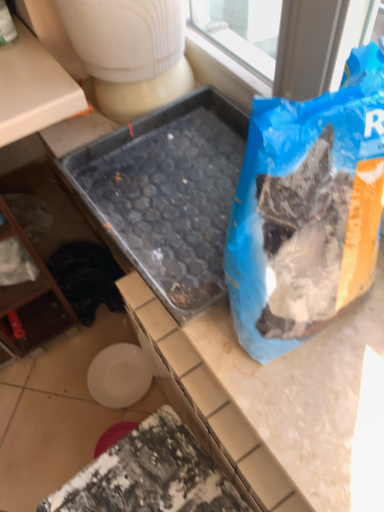
I want to click on free location in front of blue plastic bag at upper right, so click(326, 410).